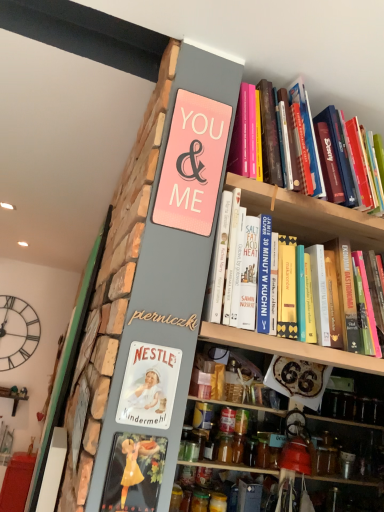
You are a GUI agent. You are given a task and a screenshot of the screen. Output one action in this format:
    pyautogui.click(x=<x>, y=<y>)
    Task: Click on the free space above hardcover books at upper right, which is counted as the second book, starting from the bottom (from a real-world perspective)
    
    Given the screenshot: What is the action you would take?
    pyautogui.click(x=329, y=92)